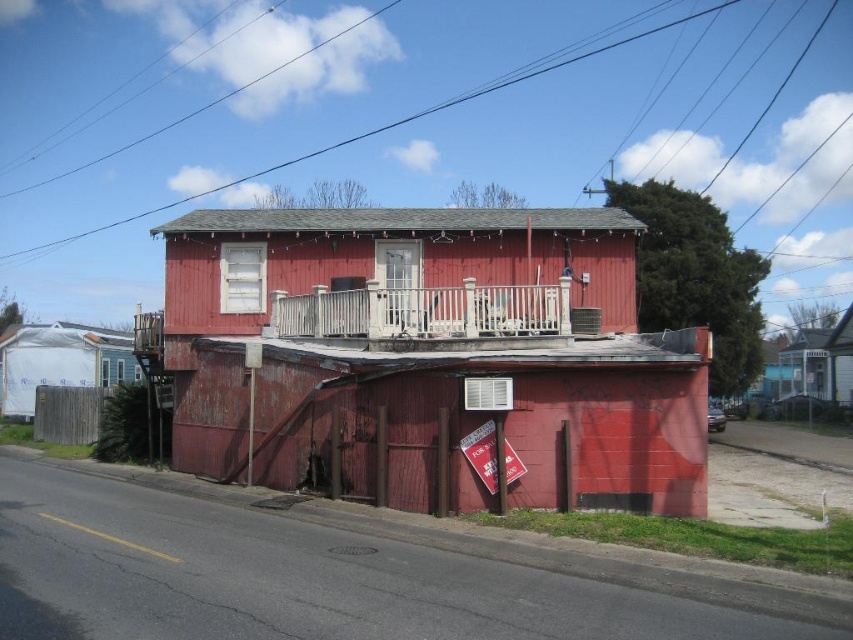
Who is more distant from viewer, (465,278) or (33,333)?

The point (33,333) is more distant.

Does point (459, 220) come behind point (45, 326)?

No.

The height and width of the screenshot is (640, 853). I want to click on rusty wood hut at center, so click(x=431, y=356).